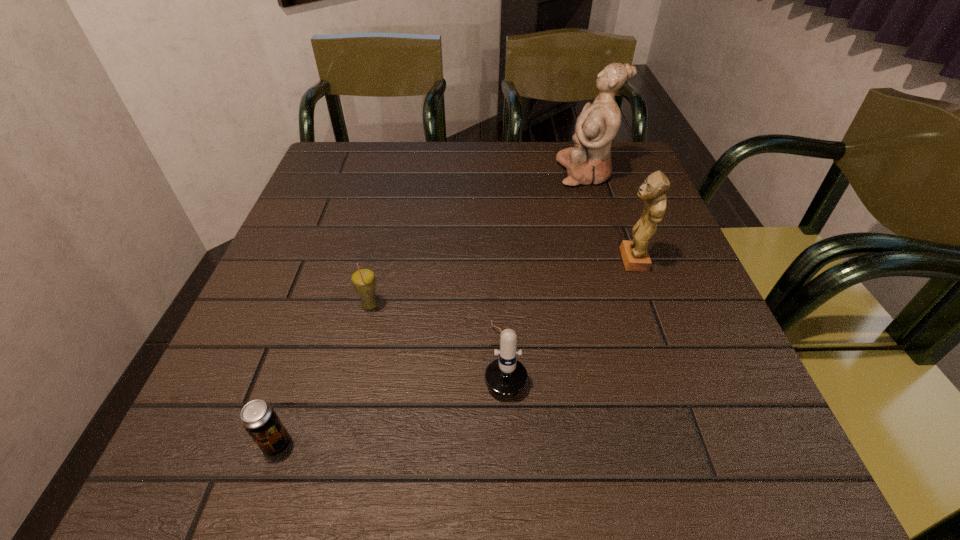
This screenshot has width=960, height=540. What are the coordinates of `object that is at the near edge` in the screenshot? It's located at (259, 419).

Where is `object at the left edge`? object at the left edge is located at coordinates (259, 419).

I want to click on object at the near left corner, so click(259, 419).

In order to click on object at the far right corner in this screenshot , I will do 589,161.

Find the location of a particular element. The image size is (960, 540). vacant space at the far edge of the desktop is located at coordinates (485, 167).

The image size is (960, 540). Identify the location of free space at the near edge of the desktop. click(569, 450).

Identify the location of free space at the left edge. (307, 212).

In the image, there is a desktop. At what (x,y) coordinates should I click in order to perform the action: click on free space at the right edge. Please return your answer as a coordinate pair (x, y). This screenshot has height=540, width=960. Looking at the image, I should click on (671, 316).

In the image, there is a desktop. At what (x,y) coordinates should I click in order to perform the action: click on free space at the far left corner. Please return your answer as a coordinate pair (x, y). This screenshot has height=540, width=960. Looking at the image, I should click on (329, 153).

The image size is (960, 540). I want to click on vacant area at the far right corner, so click(x=639, y=177).